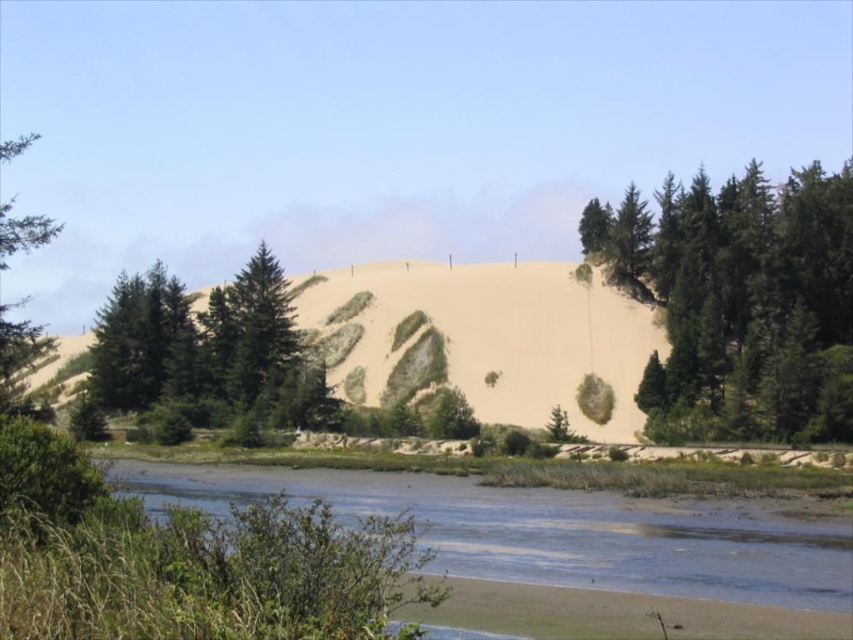
Question: In this image, where is sandy beige hillside at center located relative to green matte tree at left?

Choices:
 (A) below
 (B) above

Answer: (A)

Question: Is sandy beige hillside at center closer to the viewer compared to green matte tree at left?

Choices:
 (A) no
 (B) yes

Answer: (A)

Question: Which object is positioned closest to the brown sandy river at lower center?

Choices:
 (A) green textured tree at upper right
 (B) sandy beige hillside at center
 (C) green matte tree at left

Answer: (C)

Question: Which object appears closest to the camera in this image?

Choices:
 (A) green textured tree at upper right
 (B) brown sandy river at lower center
 (C) green matte tree at left

Answer: (B)

Question: Can you confirm if sandy beige hillside at center is bigger than green matte tree at left?

Choices:
 (A) yes
 (B) no

Answer: (B)

Question: Which object is the closest to the green textured tree at upper right?

Choices:
 (A) brown sandy river at lower center
 (B) sandy beige hillside at center
 (C) green matte tree at left

Answer: (B)